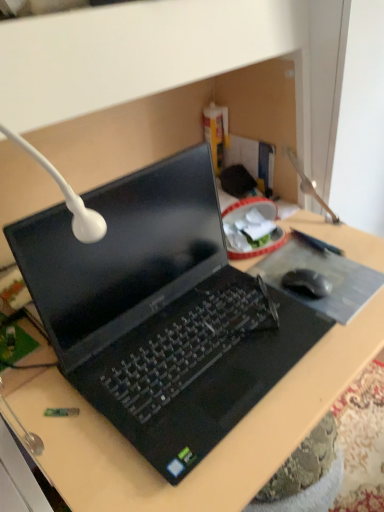
This screenshot has height=512, width=384. What are the coordinates of `vacant area on top of black matte mousepad at center (from a real-world perspective)` in the screenshot? It's located at (320, 271).